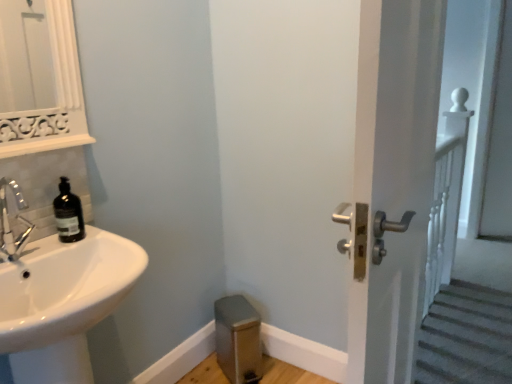
Describe the element at coordinates (63, 302) in the screenshot. I see `white glossy sink at lower left` at that location.

Where is `matte black soap dispenser at left`? matte black soap dispenser at left is located at coordinates (68, 214).

I want to click on brushed metal step stool at lower center, so click(x=238, y=339).

Where is `sink below the matte black soap dispenser at left (from a real-world perspective)`? Image resolution: width=512 pixels, height=384 pixels. sink below the matte black soap dispenser at left (from a real-world perspective) is located at coordinates (63, 302).

From a real-world perspective, is matte black soap dispenser at left physically located above or below white glossy sink at lower left?

matte black soap dispenser at left is situated higher than white glossy sink at lower left in the real world.

From the image's perspective, who appears lower, matte black soap dispenser at left or white glossy sink at lower left?

white glossy sink at lower left.

Measure the distance between matte black soap dispenser at left and white glossy sink at lower left.

They are 7.79 inches apart.

Looking at the image, does brushed metal step stool at lower center seem bigger or smaller compared to white glossy door handle at right?

brushed metal step stool at lower center is smaller than white glossy door handle at right.

Based on the photo, what's the angular difference between brushed metal step stool at lower center and white glossy door handle at right's facing directions?

The angular difference between brushed metal step stool at lower center and white glossy door handle at right is 29.8 degrees.

Is there a large distance between brushed metal step stool at lower center and white glossy door handle at right?

They are positioned close to each other.

Considering their positions, is brushed metal step stool at lower center located in front of or behind white glossy door handle at right?

Clearly, brushed metal step stool at lower center is behind white glossy door handle at right.

From the image's perspective, does brushed metal step stool at lower center appear lower than matte black soap dispenser at left?

Indeed, from the image's perspective, brushed metal step stool at lower center is shown beneath matte black soap dispenser at left.

Can you see brushed metal step stool at lower center touching matte black soap dispenser at left?

No.

In the image, is brushed metal step stool at lower center positioned in front of or behind matte black soap dispenser at left?

brushed metal step stool at lower center is behind matte black soap dispenser at left.

Which is more to the left, brushed metal step stool at lower center or matte black soap dispenser at left?

matte black soap dispenser at left is more to the left.

Considering the sizes of objects white glossy sink at lower left and white glossy door handle at right in the image provided, who is thinner, white glossy sink at lower left or white glossy door handle at right?

With smaller width is white glossy door handle at right.

What's the angular difference between white glossy sink at lower left and white glossy door handle at right's facing directions?

The angular difference between white glossy sink at lower left and white glossy door handle at right is 0.673 degrees.

Considering the positions of objects white glossy sink at lower left and white glossy door handle at right in the image provided, who is more to the left, white glossy sink at lower left or white glossy door handle at right?

Positioned to the left is white glossy sink at lower left.

From the image's perspective, is white glossy sink at lower left above or below white glossy door handle at right?

Based on their image positions, white glossy sink at lower left is located beneath white glossy door handle at right.

Which is farther, (61, 229) or (238, 359)?

Positioned behind is point (238, 359).

In the scene shown: From the image's perspective, is matte black soap dispenser at left above brushed metal step stool at lower center?

Yes.

Who is shorter, matte black soap dispenser at left or brushed metal step stool at lower center?

Standing shorter between the two is matte black soap dispenser at left.

Can you confirm if matte black soap dispenser at left is positioned to the right of brushed metal step stool at lower center?

No, matte black soap dispenser at left is not to the right of brushed metal step stool at lower center.

Are matte black soap dispenser at left and white glossy door handle at right making contact?

matte black soap dispenser at left and white glossy door handle at right are not in contact.

From a real-world perspective, between matte black soap dispenser at left and white glossy door handle at right, who is vertically higher?

matte black soap dispenser at left is physically above.

From their relative heights in the image, would you say matte black soap dispenser at left is taller or shorter than white glossy door handle at right?

Considering their sizes, matte black soap dispenser at left has less height than white glossy door handle at right.

From a real-world perspective, is white glossy door handle at right above or below brushed metal step stool at lower center?

From a real-world perspective, white glossy door handle at right is physically above brushed metal step stool at lower center.

How different are the orientations of white glossy door handle at right and brushed metal step stool at lower center in degrees?

The angle between the facing direction of white glossy door handle at right and the facing direction of brushed metal step stool at lower center is 29.8 degrees.

Based on their sizes in the image, would you say white glossy door handle at right is bigger or smaller than brushed metal step stool at lower center?

Considering their sizes, white glossy door handle at right takes up more space than brushed metal step stool at lower center.

At what (x,y) coordinates should I click in order to perform the action: click on bottle lying behind the white glossy sink at lower left. Please return your answer as a coordinate pair (x, y). The width and height of the screenshot is (512, 384). Looking at the image, I should click on (68, 214).

The image size is (512, 384). Find the location of `screen door in front of the brushed metal step stool at lower center`. screen door in front of the brushed metal step stool at lower center is located at coordinates (403, 179).

Considering their positions, is matte black soap dispenser at left positioned further to white glossy door handle at right than brushed metal step stool at lower center?

matte black soap dispenser at left.

When comparing their distances from white glossy door handle at right, does white glossy sink at lower left or matte black soap dispenser at left seem closer?

Based on the image, white glossy sink at lower left appears to be nearer to white glossy door handle at right.

Looking at this image, looking at the image, which one is located further to white glossy door handle at right, matte black soap dispenser at left or white glossy sink at lower left?

matte black soap dispenser at left is positioned further to the anchor white glossy door handle at right.

Estimate the real-world distances between objects in this image. Which object is further from white glossy sink at lower left, white glossy door handle at right or brushed metal step stool at lower center?

The object further to white glossy sink at lower left is brushed metal step stool at lower center.

Based on their spatial positions, is white glossy sink at lower left or white glossy door handle at right closer to matte black soap dispenser at left?

white glossy sink at lower left is positioned closer to the anchor matte black soap dispenser at left.

Based on their spatial positions, is white glossy door handle at right or brushed metal step stool at lower center closer to matte black soap dispenser at left?

The object closer to matte black soap dispenser at left is brushed metal step stool at lower center.

Which object lies nearer to the anchor point white glossy sink at lower left, brushed metal step stool at lower center or matte black soap dispenser at left?

matte black soap dispenser at left is closer to white glossy sink at lower left.

Considering their positions, is white glossy sink at lower left positioned closer to white glossy door handle at right than brushed metal step stool at lower center?

white glossy sink at lower left.

What are the coordinates of `sink between matte black soap dispenser at left and white glossy door handle at right in the horizontal direction` in the screenshot? It's located at (63, 302).

This screenshot has width=512, height=384. I want to click on step stool between matte black soap dispenser at left and white glossy door handle at right from left to right, so click(238, 339).

Identify the location of bottle positioned between white glossy sink at lower left and brushed metal step stool at lower center from near to far. The width and height of the screenshot is (512, 384). (68, 214).

This screenshot has width=512, height=384. In order to click on step stool located between white glossy sink at lower left and white glossy door handle at right in the left-right direction in this screenshot , I will do `click(238, 339)`.